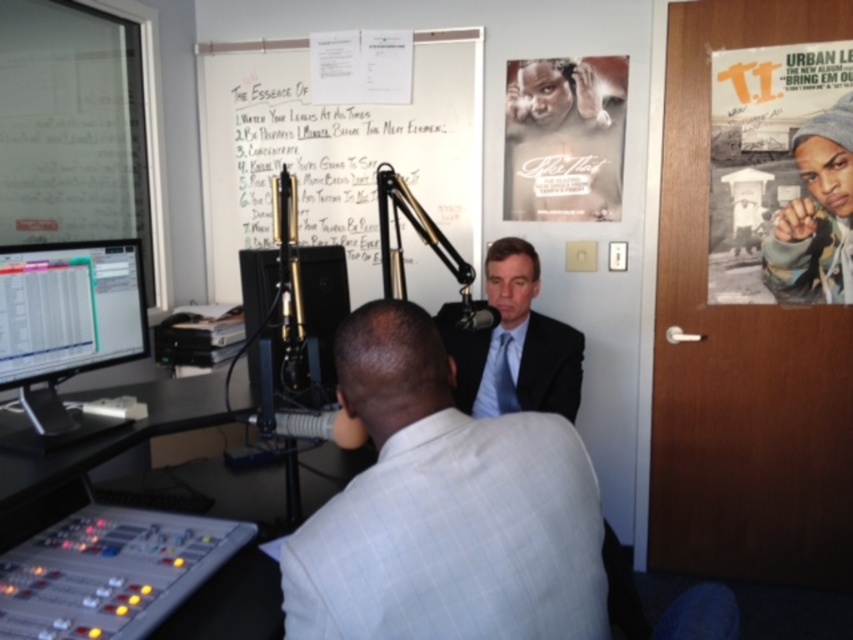
Does white textured suit at center come in front of black paper poster at door right?

Yes.

Can you confirm if white textured suit at center is shorter than black paper poster at door right?

Yes, white textured suit at center is shorter than black paper poster at door right.

At what (x,y) coordinates should I click in order to perform the action: click on white textured suit at center. Please return your answer as a coordinate pair (x, y). Looking at the image, I should click on (445, 508).

Measure the distance from white textured suit at center to matte black monitor at left.

A distance of 36.80 inches exists between white textured suit at center and matte black monitor at left.

Is white textured suit at center closer to the viewer compared to matte black monitor at left?

Yes, white textured suit at center is in front of matte black monitor at left.

The height and width of the screenshot is (640, 853). Identify the location of white textured suit at center. (445, 508).

Does point (512, 493) come behind point (520, 244)?

No, it is in front of (520, 244).

Does white textured suit at center have a greater width compared to matte black suit at center?

In fact, white textured suit at center might be narrower than matte black suit at center.

Which is in front, point (602, 570) or point (525, 396)?

Positioned in front is point (602, 570).

Image resolution: width=853 pixels, height=640 pixels. In order to click on white textured suit at center in this screenshot , I will do coord(445,508).